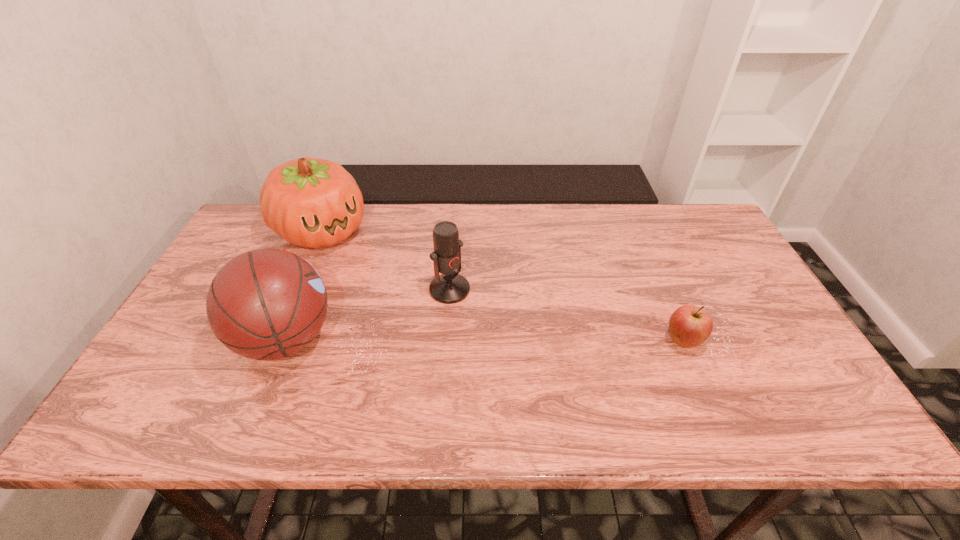
The image size is (960, 540). What are the coordinates of `free space on the desktop that is between the basketball and the rightmost object and is positioned on the side of the pumpkin with the cute face` in the screenshot? It's located at (436, 340).

Where is `vacant space on the desktop that is between the basketball and the rightmost object and is positioned on the side of the second object from right to left with the red ring`? Image resolution: width=960 pixels, height=540 pixels. vacant space on the desktop that is between the basketball and the rightmost object and is positioned on the side of the second object from right to left with the red ring is located at coordinates (504, 340).